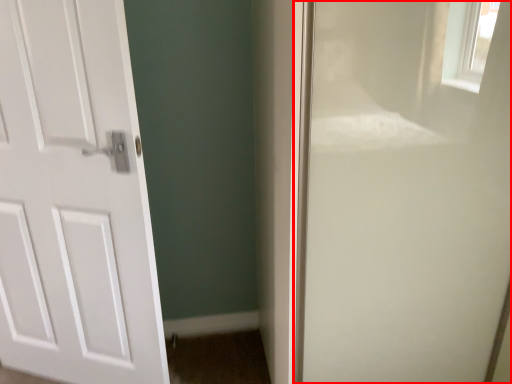
Question: From the image's perspective, considering the relative positions of screen door (annotated by the red box) and door in the image provided, where is screen door (annotated by the red box) located with respect to the staircase?

Choices:
 (A) above
 (B) below

Answer: (A)